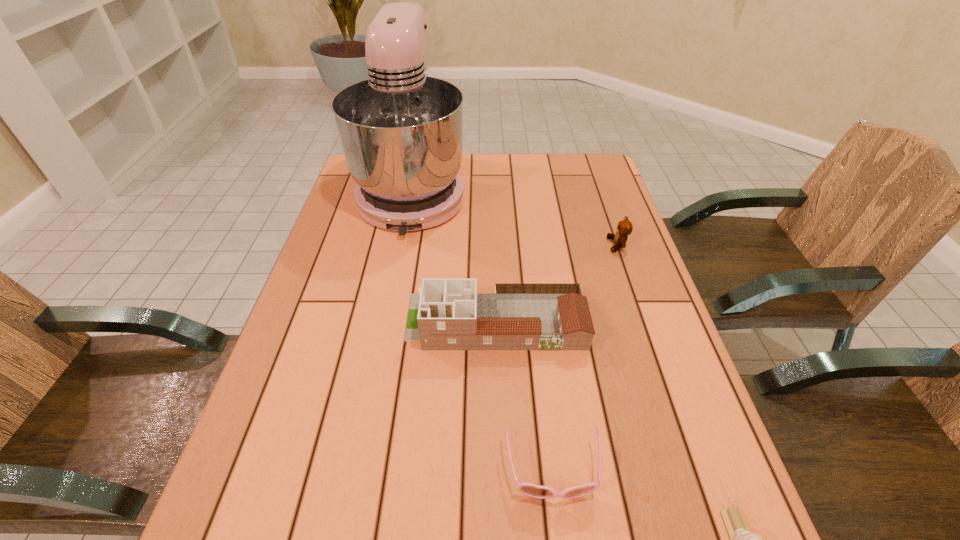
This screenshot has height=540, width=960. Identify the location of mixer. (401, 131).

Locate an element on the screen. The image size is (960, 540). the third farthest object is located at coordinates (447, 314).

The width and height of the screenshot is (960, 540). I want to click on the second tallest object, so click(x=447, y=314).

At what (x,y) coordinates should I click in order to perform the action: click on the third tallest object. Please return your answer as a coordinate pair (x, y). Looking at the image, I should click on coord(624,228).

Where is `sunglasses`? This screenshot has width=960, height=540. sunglasses is located at coordinates (539, 492).

This screenshot has height=540, width=960. Identify the location of free space located on the front-facing side of the tallest object. (390, 310).

This screenshot has height=540, width=960. What are the coordinates of `free space located at the main entrance of the dollhouse` in the screenshot? It's located at (333, 321).

The height and width of the screenshot is (540, 960). Identify the location of free location located at the main entrance of the dollhouse. (359, 321).

Find the location of a particular element. free space located 0.190m at the main entrance of the dollhouse is located at coordinates (324, 321).

Find the location of a particular element. This screenshot has height=540, width=960. vacant area situated 0.090m on the front-facing side of the third tallest object is located at coordinates (575, 245).